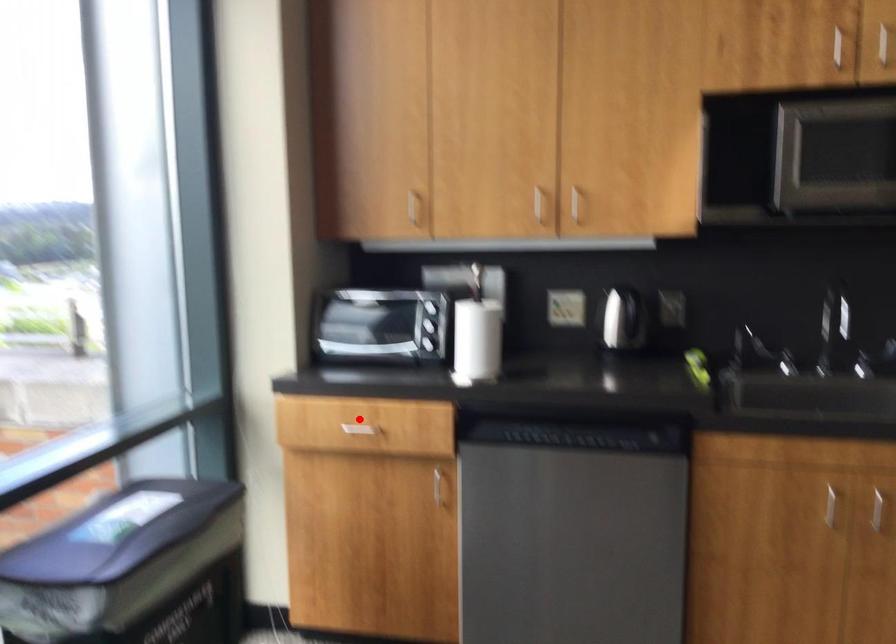
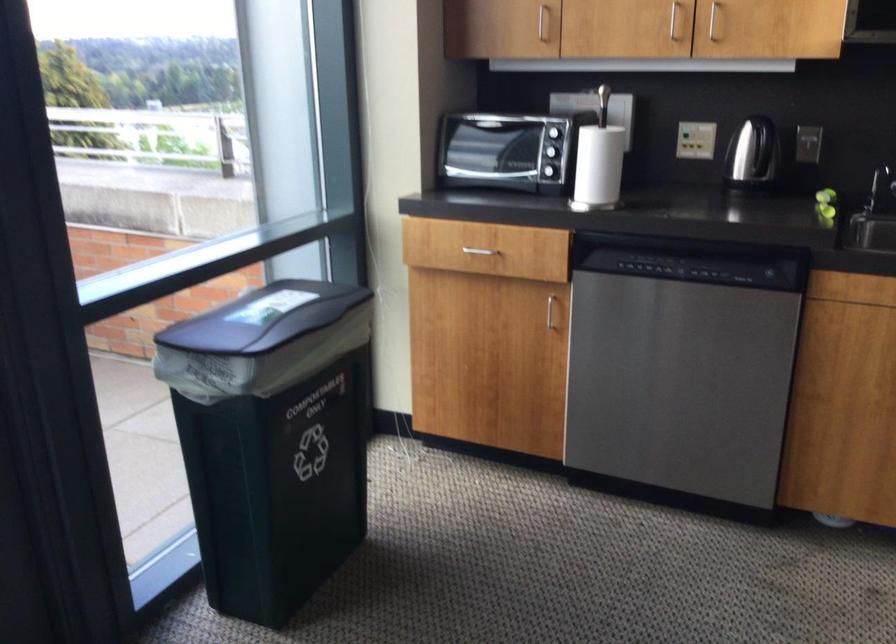
Find the pixel in the second image that matches the highlighted location in the first image.

(474, 241)